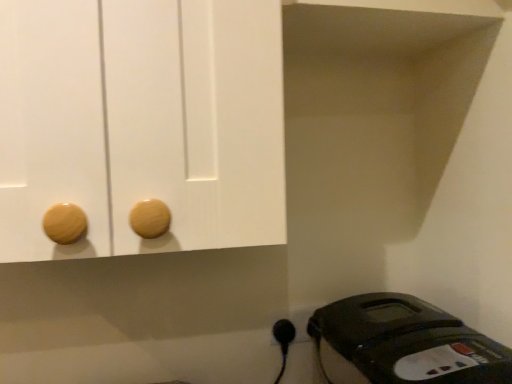
Question: Considering the relative sizes of black plastic outlet at lower right and black plastic iron at lower right in the image provided, is black plastic outlet at lower right shorter than black plastic iron at lower right?

Choices:
 (A) no
 (B) yes

Answer: (B)

Question: Does black plastic outlet at lower right come in front of black plastic iron at lower right?

Choices:
 (A) yes
 (B) no

Answer: (B)

Question: Could you tell me if black plastic outlet at lower right is turned towards black plastic iron at lower right?

Choices:
 (A) no
 (B) yes

Answer: (B)

Question: From the image's perspective, is black plastic outlet at lower right under black plastic iron at lower right?

Choices:
 (A) yes
 (B) no

Answer: (B)

Question: From the image's perspective, does black plastic outlet at lower right appear higher than black plastic iron at lower right?

Choices:
 (A) no
 (B) yes

Answer: (B)

Question: Would you say black plastic outlet at lower right is to the left or to the right of black plastic iron at lower right in the picture?

Choices:
 (A) left
 (B) right

Answer: (A)

Question: Is black plastic outlet at lower right taller or shorter than black plastic iron at lower right?

Choices:
 (A) tall
 (B) short

Answer: (B)

Question: Is black plastic outlet at lower right wider or thinner than black plastic iron at lower right?

Choices:
 (A) thin
 (B) wide

Answer: (A)

Question: Is black plastic outlet at lower right inside the boundaries of black plastic iron at lower right, or outside?

Choices:
 (A) outside
 (B) inside

Answer: (A)

Question: From the image's perspective, is black plastic plug at lower right above or below black plastic iron at lower right?

Choices:
 (A) above
 (B) below

Answer: (A)

Question: Is black plastic plug at lower right taller or shorter than black plastic iron at lower right?

Choices:
 (A) tall
 (B) short

Answer: (B)

Question: Looking at the image, does black plastic plug at lower right seem bigger or smaller compared to black plastic iron at lower right?

Choices:
 (A) big
 (B) small

Answer: (B)

Question: In the image, is black plastic plug at lower right on the left side or the right side of black plastic iron at lower right?

Choices:
 (A) left
 (B) right

Answer: (A)

Question: From the image's perspective, is black plastic outlet at lower right above or below black plastic plug at lower right?

Choices:
 (A) below
 (B) above

Answer: (B)

Question: Is black plastic outlet at lower right in front of or behind black plastic plug at lower right in the image?

Choices:
 (A) behind
 (B) front

Answer: (A)